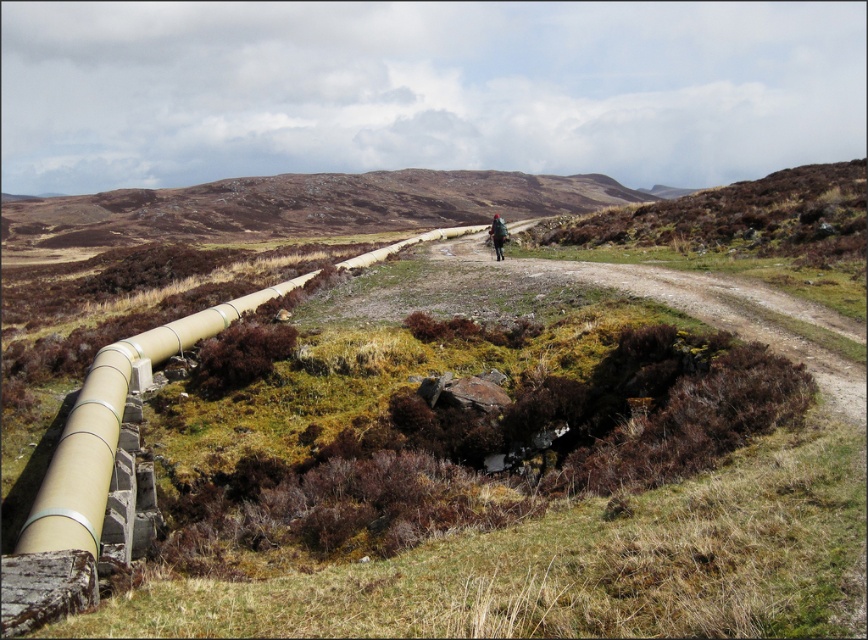
You are a hiker who has just reached the center of the scene. You see the brown grassy hillside at center and the dark brown leather backpack at center. Which object takes up more space in the scene?

The brown grassy hillside at center takes up more space in the scene than the dark brown leather backpack at center because it is larger in size.

You are a hiker carrying the dark brown leather backpack at center. You want to place it on the brown grassy hillside at center. Will the backpack fit entirely on the hillside without any part hanging off?

The brown grassy hillside at center is wider than the dark brown leather backpack at center, so yes, the backpack will fit entirely on the hillside without any part hanging off.